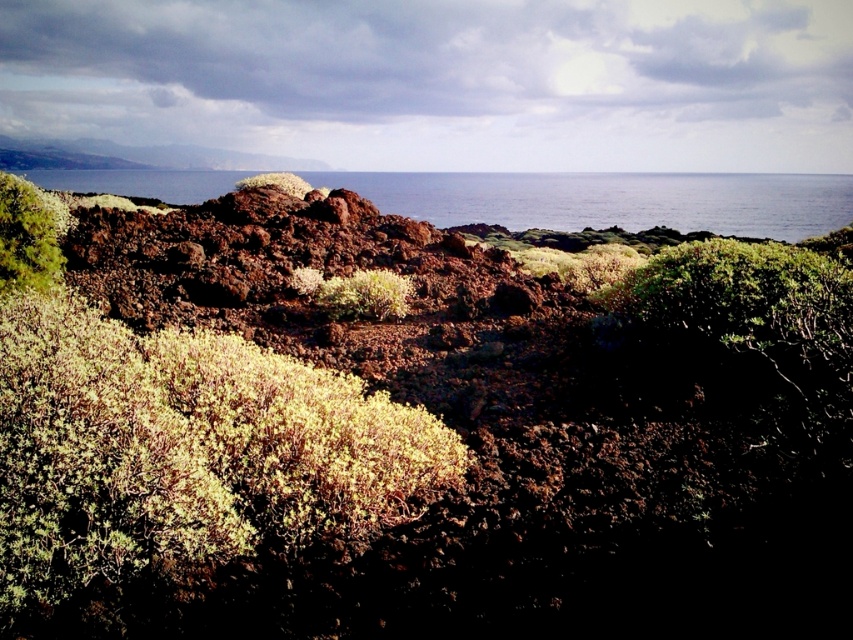
Is point (833, 228) positioned in front of point (265, 173)?

No, it is not.

Does point (689, 216) lie in front of point (242, 184)?

That is False.

Find the location of a particular element. The image size is (853, 640). blue water at center is located at coordinates (612, 200).

Is green fuzzy bush at center below green fuzzy rock at center?

Indeed, green fuzzy bush at center is positioned under green fuzzy rock at center.

Describe the element at coordinates (364, 294) in the screenshot. I see `green fuzzy bush at center` at that location.

The height and width of the screenshot is (640, 853). I want to click on green fuzzy bush at center, so click(x=364, y=294).

What do you see at coordinates (612, 200) in the screenshot?
I see `blue water at center` at bounding box center [612, 200].

Does blue water at center appear over green fuzzy bush at center?

Indeed, blue water at center is positioned over green fuzzy bush at center.

In order to click on blue water at center in this screenshot , I will do `click(612, 200)`.